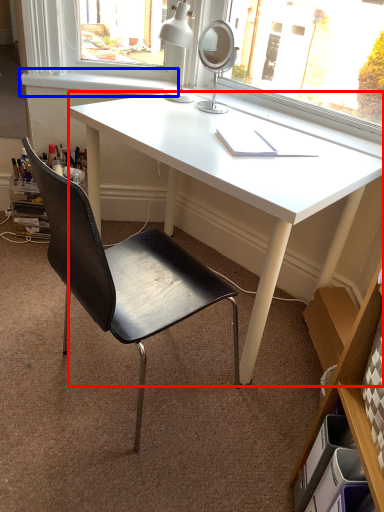
Question: Which of the following is the closest to the observer, desk (highlighted by a red box) or window sill (highlighted by a blue box)?

Choices:
 (A) desk
 (B) window sill

Answer: (A)